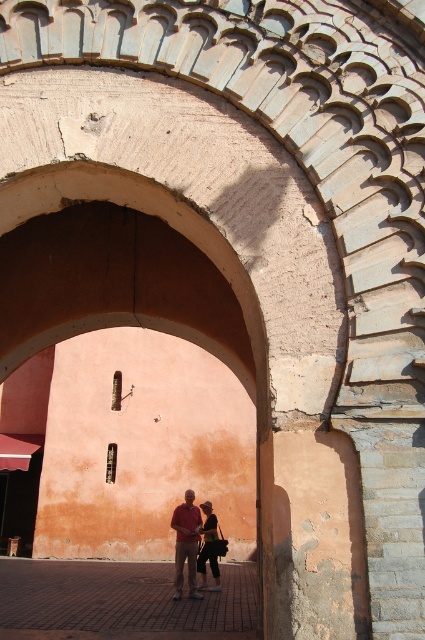
Between matte red shirt at center and dark brown leather jacket at center, which one appears on the left side from the viewer's perspective?

From the viewer's perspective, matte red shirt at center appears more on the left side.

This screenshot has width=425, height=640. Describe the element at coordinates (186, 544) in the screenshot. I see `matte red shirt at center` at that location.

Which is in front, point (192, 502) or point (215, 579)?

Point (215, 579)

Find the location of `matte red shirt at center`. matte red shirt at center is located at coordinates (186, 544).